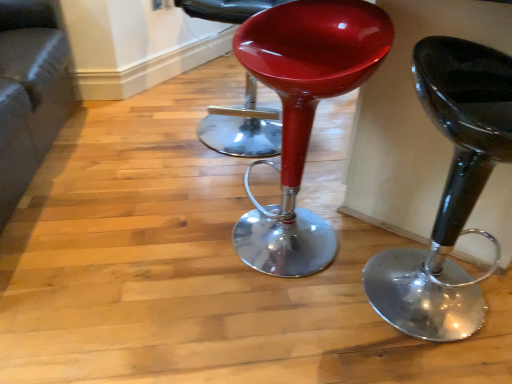
Question: Would you say velvet grey couch at lower left is inside or outside glossy plastic stool at center?

Choices:
 (A) outside
 (B) inside

Answer: (A)

Question: Considering their positions, is velvet grey couch at lower left located in front of or behind glossy plastic stool at center?

Choices:
 (A) behind
 (B) front

Answer: (B)

Question: Based on their relative distances, which object is nearer to the glossy plastic stool at center, the 2th stool in the left-to-right sequence?

Choices:
 (A) glossy plastic stool at center, the 2th stool when ordered from right to left
 (B) velvet grey couch at lower left
 (C) glossy plastic stool at center

Answer: (A)

Question: Considering the real-world distances, which object is closest to the glossy plastic stool at center, the 2th stool in the left-to-right sequence?

Choices:
 (A) glossy plastic stool at center
 (B) velvet grey couch at lower left
 (C) glossy plastic stool at center, the 2th stool when ordered from right to left

Answer: (C)